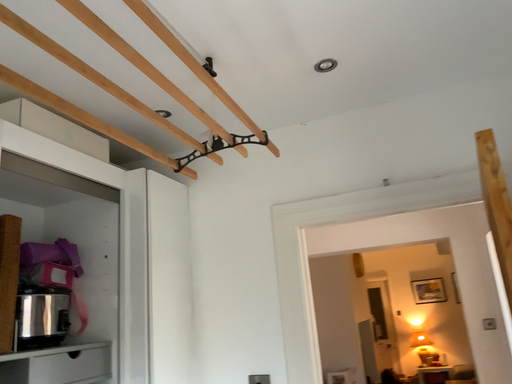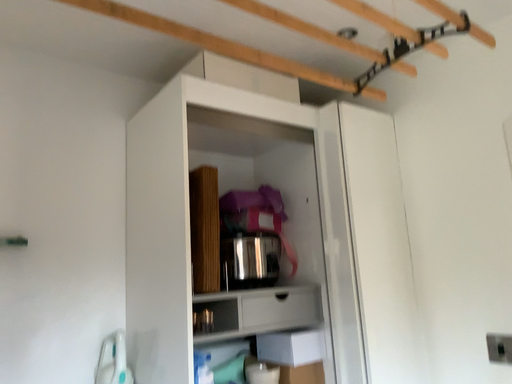
Question: Which way did the camera rotate in the video?

Choices:
 (A) rotated downward
 (B) rotated upward

Answer: (A)